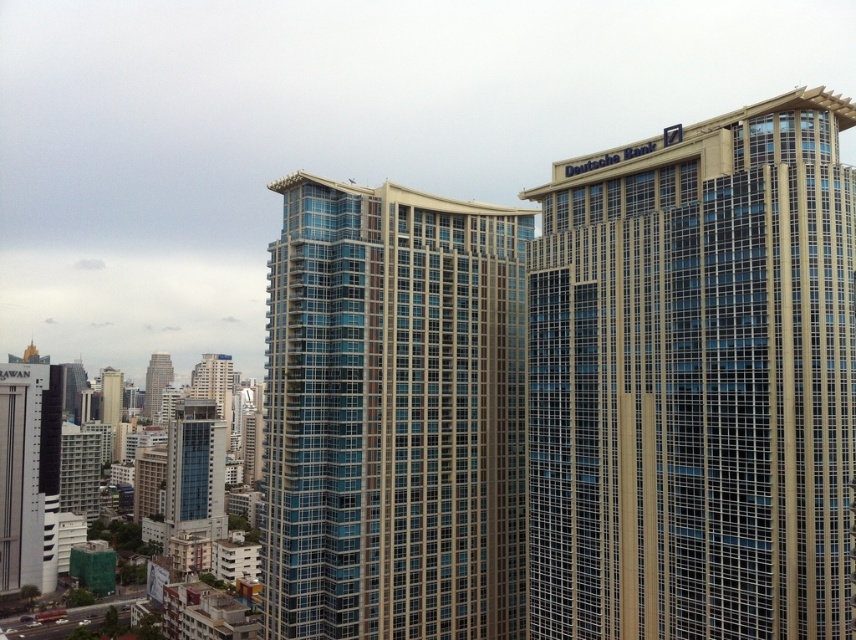
You are an urban planner assessing the skyline. Which of the two buildings, the gold glass building at upper right or the glassy blue building at center, has a greater height?

The glassy blue building at center is taller than the gold glass building at upper right.

You are standing in the city looking at the Deutsche Bank building and the other building. There are two points marked on the image. The first point is at coordinate (x=631, y=266) and the second point is at (x=406, y=451). If you were to walk towards the Deutsche Bank building, which point would you encounter first?

The point at coordinate (x=631, y=266) is closer to the camera than the point at (x=406, y=451). Therefore, you would encounter the point at (x=631, y=266) first when walking towards the Deutsche Bank building.

You are standing at the point marked by the coordinates point (195, 468) in the cityscape. Looking around, you see the Deutsche Bank building and another similar skyscraper. Which building is directly in front of you?

The point (195, 468) marks the glassy blue skyscraper at center left, so the building directly in front of you is the glassy blue skyscraper at center left.